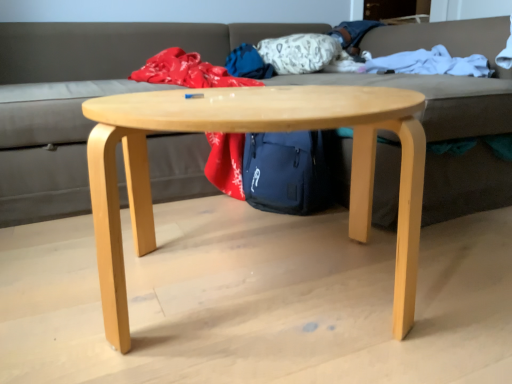
Question: Would you say gray fabric couch at center is part of natural wood coffee table at center's contents?

Choices:
 (A) no
 (B) yes

Answer: (A)

Question: Is the surface of natural wood coffee table at center in direct contact with gray fabric couch at center?

Choices:
 (A) no
 (B) yes

Answer: (A)

Question: Is natural wood coffee table at center oriented away from gray fabric couch at center?

Choices:
 (A) yes
 (B) no

Answer: (A)

Question: Does natural wood coffee table at center have a larger size compared to gray fabric couch at center?

Choices:
 (A) yes
 (B) no

Answer: (B)

Question: Considering the relative positions of natural wood coffee table at center and gray fabric couch at center in the image provided, is natural wood coffee table at center behind gray fabric couch at center?

Choices:
 (A) no
 (B) yes

Answer: (A)

Question: Relative to white soft blanket at upper right, is natural wood coffee table at center in front or behind?

Choices:
 (A) behind
 (B) front

Answer: (B)

Question: Does point (118, 309) appear closer or farther from the camera than point (369, 66)?

Choices:
 (A) closer
 (B) farther

Answer: (A)

Question: Is natural wood coffee table at center inside the boundaries of white soft blanket at upper right, or outside?

Choices:
 (A) outside
 (B) inside

Answer: (A)

Question: Is natural wood coffee table at center wider or thinner than white soft blanket at upper right?

Choices:
 (A) thin
 (B) wide

Answer: (B)

Question: Do you think white soft blanket at upper right is within gray fabric couch at center, or outside of it?

Choices:
 (A) inside
 (B) outside

Answer: (A)

Question: From a real-world perspective, relative to gray fabric couch at center, is white soft blanket at upper right vertically above or below?

Choices:
 (A) below
 (B) above

Answer: (B)

Question: Visually, is white soft blanket at upper right positioned to the left or to the right of gray fabric couch at center?

Choices:
 (A) right
 (B) left

Answer: (A)

Question: Looking at the image, does white soft blanket at upper right seem bigger or smaller compared to gray fabric couch at center?

Choices:
 (A) small
 (B) big

Answer: (A)

Question: From the image's perspective, is gray fabric couch at center above or below white soft blanket at upper right?

Choices:
 (A) above
 (B) below

Answer: (B)

Question: Considering the positions of gray fabric couch at center and white soft blanket at upper right in the image, is gray fabric couch at center bigger or smaller than white soft blanket at upper right?

Choices:
 (A) small
 (B) big

Answer: (B)